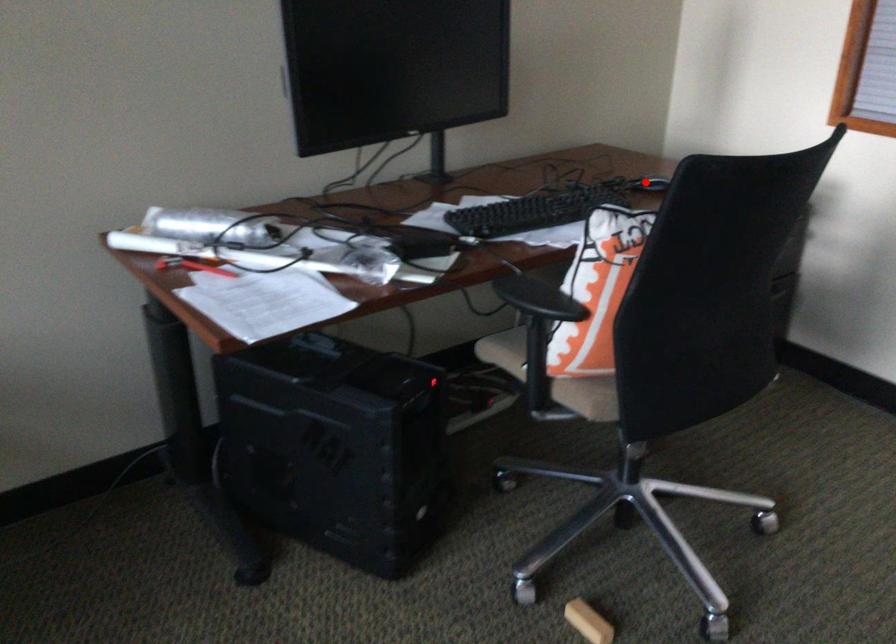
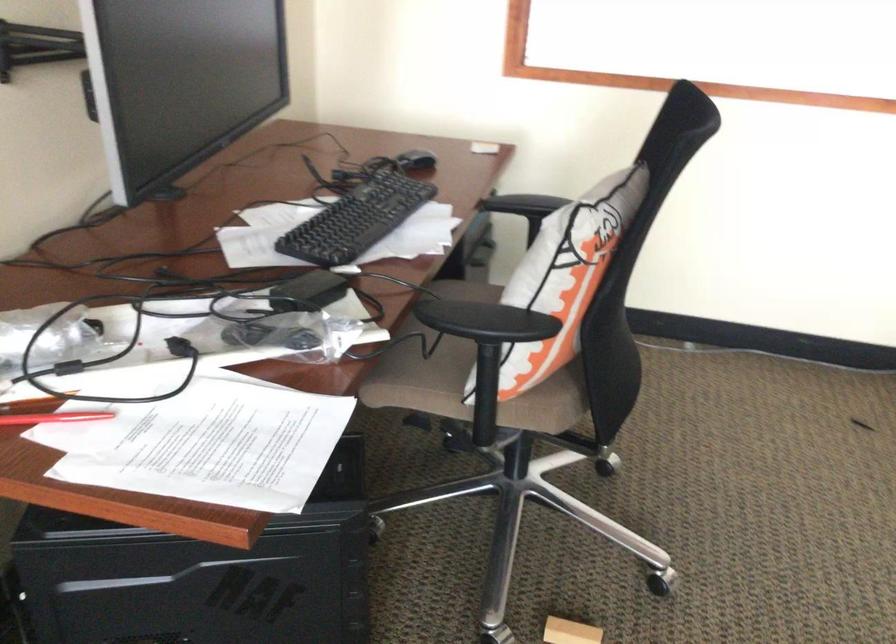
In the second image, find the point that corresponds to the highlighted location in the first image.

(416, 162)